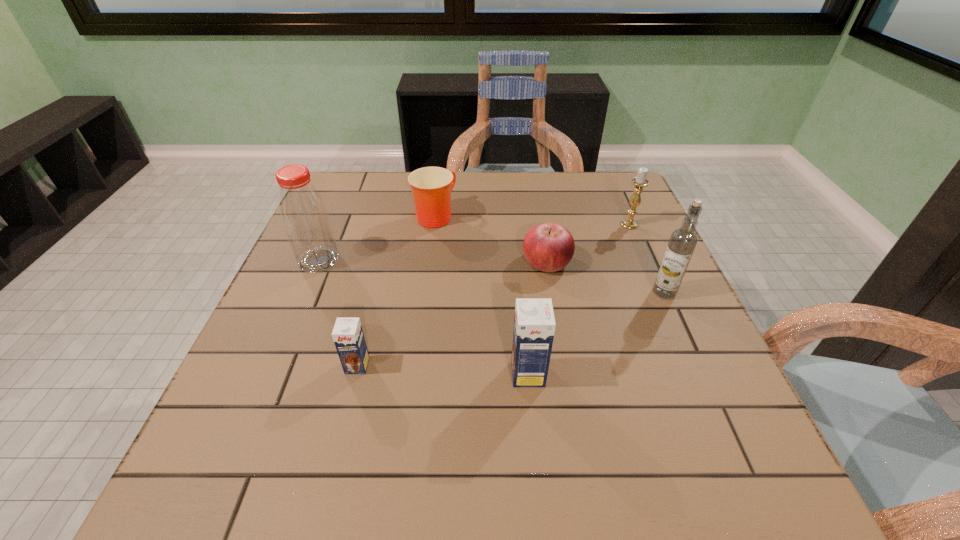
This screenshot has height=540, width=960. What are the coordinates of `free space between the leftmost object and the vodka` in the screenshot? It's located at (492, 276).

Identify the location of free space between the apple and the bottle. (433, 261).

Identify the location of free space between the right chocolate milk and the candle holder. (579, 299).

Image resolution: width=960 pixels, height=540 pixels. In order to click on vacant region between the bottle and the vodka in this screenshot , I will do click(x=492, y=276).

The height and width of the screenshot is (540, 960). Identify the location of vacant space that is in between the taller chocolate milk and the left chocolate milk. (443, 370).

The width and height of the screenshot is (960, 540). What are the coordinates of `free space that is in between the candle holder and the bottle` in the screenshot? It's located at (474, 242).

I want to click on free space between the cup and the taller chocolate milk, so click(x=481, y=295).

This screenshot has height=540, width=960. Identify the location of vacant region between the bottle and the fifth object from right to left. (376, 238).

Locate which object is the second closest to the apple. Please provide its 2D coordinates. Your answer should be formatted as a tuple, i.e. [(x, y)], where the tuple contains the x and y coordinates of a point satisfying the conditions above.

[(640, 181)]

Identify which object is the fourth nearest to the candle holder. Please provide its 2D coordinates. Your answer should be formatted as a tuple, i.e. [(x, y)], where the tuple contains the x and y coordinates of a point satisfying the conditions above.

[(534, 324)]